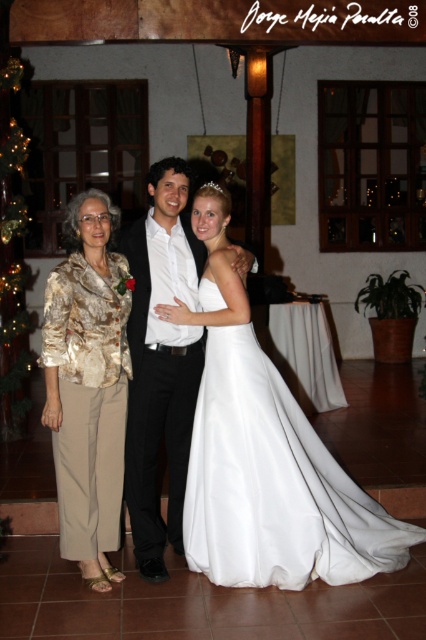
You are a photographer trying to adjust the lighting for a group photo. The scene includes a white satin dress at center and a shiny black suit at center. Which object should you focus on first if you want to ensure proper exposure for the taller one?

The shiny black suit at center is taller than the white satin dress at center, so you should focus on the shiny black suit at center first to ensure proper exposure for the taller one.

You are a photographer arranging a group photo. You need to ensure that the gold textured blouse at left and the shiny black suit at center are visible in the frame. Given their sizes, which one might require more space to fully capture in the photo?

The shiny black suit at center requires more space because its width is greater than the gold textured blouse at left.

You are a photographer at the wedding reception and need to adjust the camera settings to capture a group photo of the older woman in beige and gold, the man in the black suit, and the woman in the white satin dress at center. The camera has a minimum focus distance of 10 feet. Can you take the photo without moving the subjects?

The subjects are 11.55 feet apart, which is greater than the camera minimum focus distance of 10 feet. Therefore, you can take the photo without moving the subjects.